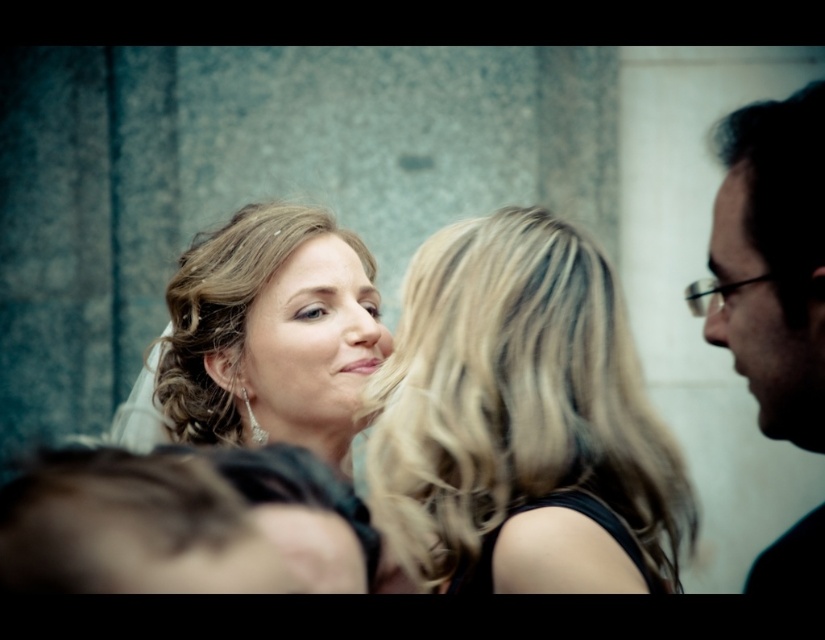
You are a photographer at a social event. You need to adjust your camera to capture both the blonde shiny hair at center and the dark brown hair at right clearly. Which one requires you to focus on a closer distance?

The blonde shiny hair at center requires focusing on a closer distance because it is larger in size than the dark brown hair at right, indicating it is nearer to the camera.